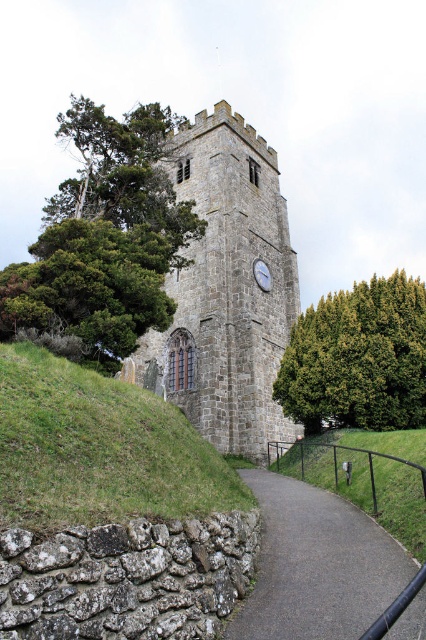
Question: Which point is closer to the camera?

Choices:
 (A) green leafy tree at upper left
 (B) black asphalt path at lower center

Answer: (B)

Question: Is gray stone clock tower at center positioned behind green grassy hillside at lower left?

Choices:
 (A) yes
 (B) no

Answer: (A)

Question: Which point appears farthest from the camera in this image?

Choices:
 (A) (339, 563)
 (B) (259, 141)

Answer: (B)

Question: Can you confirm if green textured tree at center-right is positioned to the left of green grass at lower right?

Choices:
 (A) no
 (B) yes

Answer: (A)

Question: In this image, where is green leafy tree at upper left located relative to green grass at lower right?

Choices:
 (A) below
 (B) above

Answer: (B)

Question: Which point is closer to the camera?

Choices:
 (A) (333, 515)
 (B) (192, 186)
 (C) (337, 352)

Answer: (A)